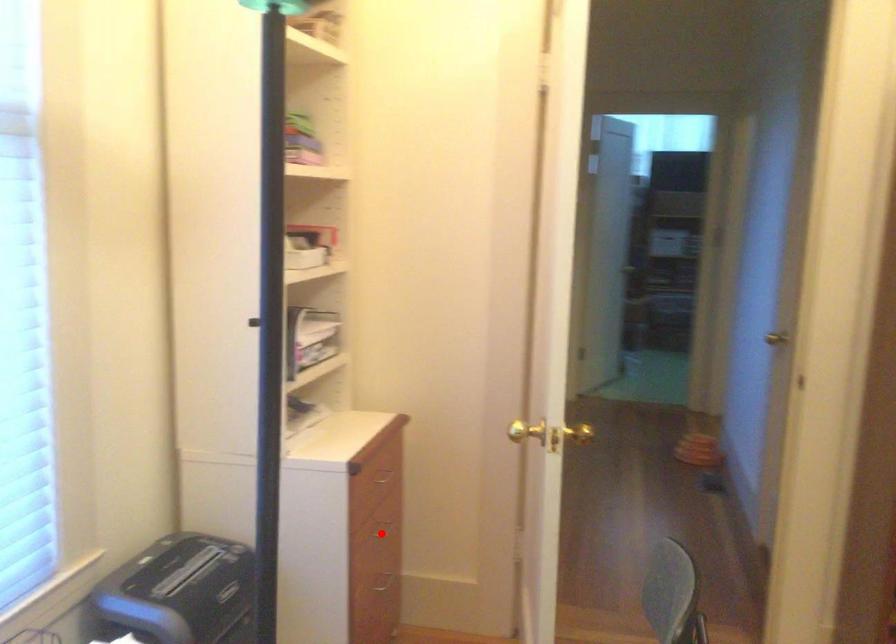
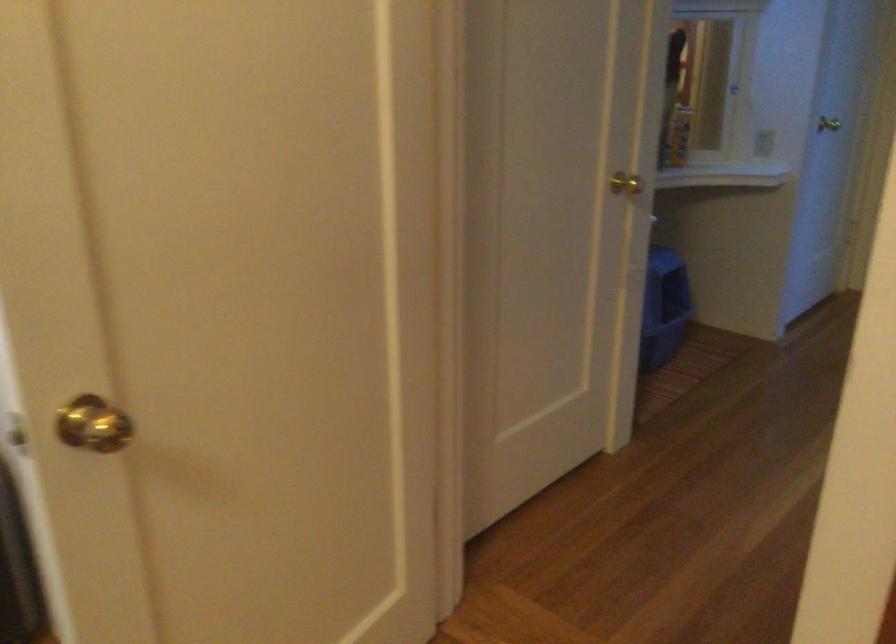
Question: I am providing you with two images of the same scene from different viewpoints. A red point is marked on the first image. At the location where the point appears in image 1, is it still visible in image 2?

Choices:
 (A) Yes
 (B) No

Answer: (B)